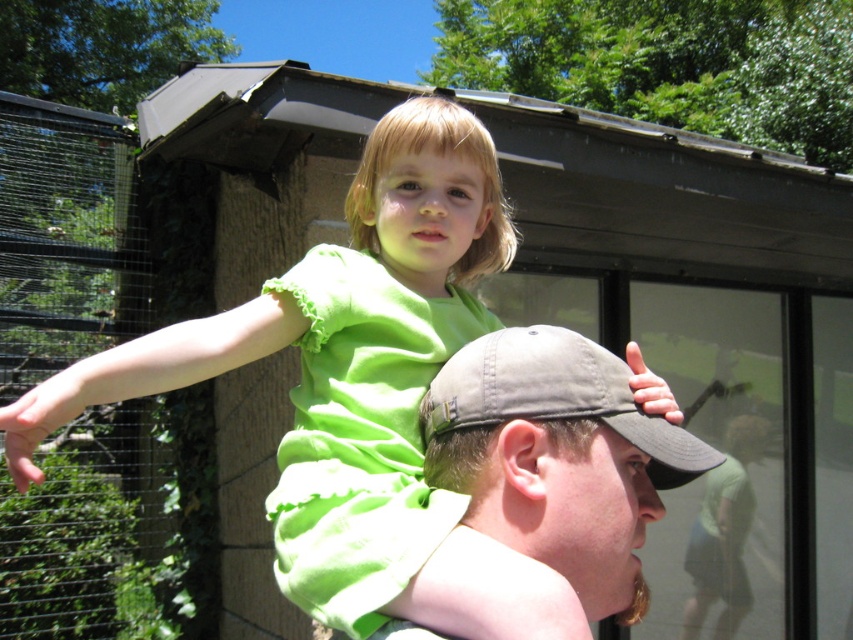
Which of these two, khaki fabric baseball cap at upper center or green fabric shirt at upper center, stands shorter?

khaki fabric baseball cap at upper center

Between point (654, 428) and point (727, 449), which one is positioned behind?

The point (727, 449) is more distant.

Between point (573, 392) and point (735, 547), which one is positioned behind?

The point (735, 547) is behind.

The height and width of the screenshot is (640, 853). I want to click on khaki fabric baseball cap at upper center, so click(x=556, y=394).

Is green matte dress at upper center closer to camera compared to khaki fabric baseball cap at upper center?

Yes.

Which is more to the right, green matte dress at upper center or khaki fabric baseball cap at upper center?

Positioned to the right is khaki fabric baseball cap at upper center.

Which is in front, point (393, 564) or point (672, 477)?

Point (393, 564) is in front.

Where is `green matte dress at upper center`? This screenshot has width=853, height=640. green matte dress at upper center is located at coordinates (358, 392).

Identify the location of matte khaki cap at center. (556, 456).

Can you confirm if matte khaki cap at center is shorter than khaki fabric baseball cap at upper center?

No, matte khaki cap at center is not shorter than khaki fabric baseball cap at upper center.

At what (x,y) coordinates should I click in order to perform the action: click on matte khaki cap at center. Please return your answer as a coordinate pair (x, y). This screenshot has height=640, width=853. Looking at the image, I should click on (556, 456).

This screenshot has width=853, height=640. In order to click on matte khaki cap at center in this screenshot , I will do `click(556, 456)`.